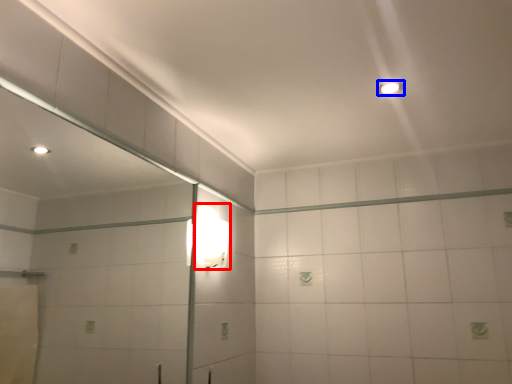
Question: Which object is closer to the camera taking this photo, light fixture (highlighted by a red box) or light fixture (highlighted by a blue box)?

Choices:
 (A) light fixture
 (B) light fixture

Answer: (B)